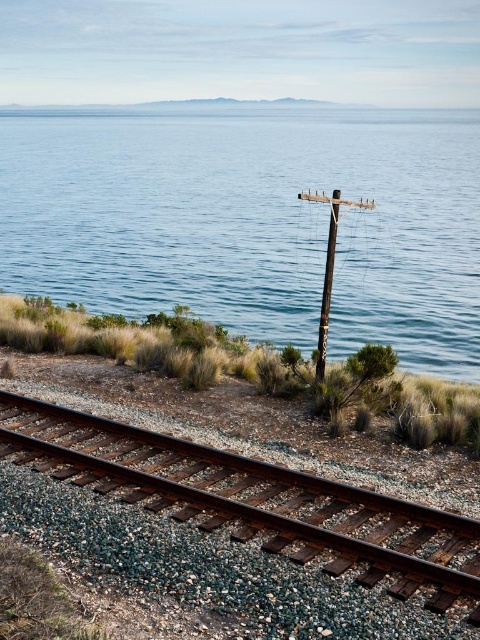
You are standing on the railway track in the image and looking towards the distant curve. There are two points marked on the track ahead of you at coordinates point (295, 150) and point (319, 356). Which point is closer to your current position?

Point (295, 150) is closer to your current position because it is further to the camera than point (319, 356), meaning it is nearer to you.

You are standing at the origin point of the coordinate system, which is at the bottom left corner of the image. You want to walk towards the brown wooden telegraph pole at center. In which direction should you head?

Since the brown wooden telegraph pole at center is located at coordinate point (328, 266), you should head northeast to reach it from the origin point at the bottom left corner.

You are standing at the starting point of the railway track in the coastal scene. You want to reach the blue water at center. Which direction should you walk to get there?

The blue water at center is located at coordinates approximately 0.347 along the horizontal axis and 0.529 along the vertical axis. Since you are at the starting point of the railway track, which is likely at the lower part of the image, moving towards the blue water at center would involve walking upwards and slightly to the right based on the given coordinates.